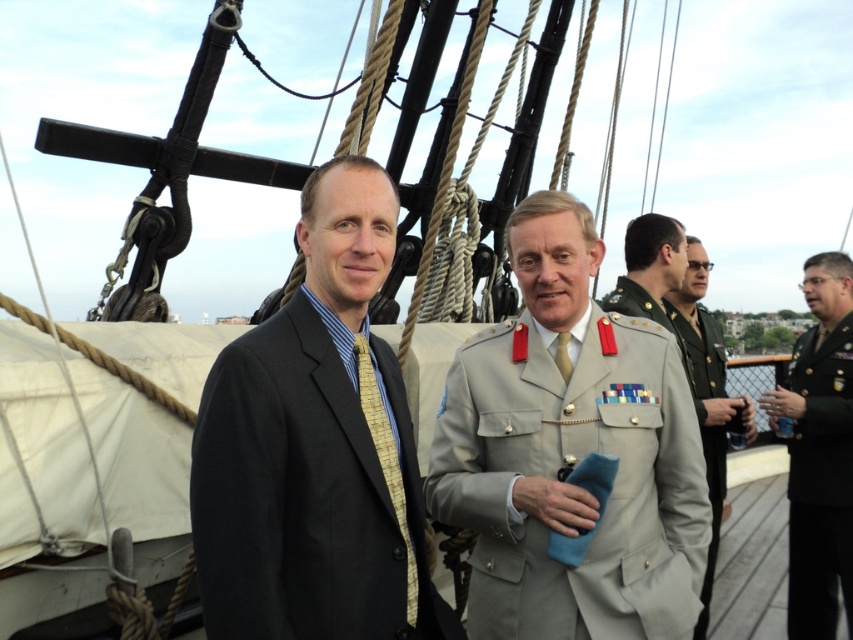
Between dark green military uniform at right and khaki military uniform at center, which one appears on the right side from the viewer's perspective?

dark green military uniform at right is more to the right.

Is dark green military uniform at right to the right of khaki military uniform at center from the viewer's perspective?

Indeed, dark green military uniform at right is positioned on the right side of khaki military uniform at center.

Locate an element on the screen. This screenshot has height=640, width=853. dark green military uniform at right is located at coordinates (819, 451).

Does matte black suit at center appear on the left side of light beige uniform at center?

Yes, matte black suit at center is to the left of light beige uniform at center.

Between matte black suit at center and light beige uniform at center, which one is positioned higher?

light beige uniform at center is above.

Is point (399, 636) less distant than point (646, 273)?

Yes, it is.

I want to click on matte black suit at center, so click(316, 448).

Who is lower down, khaki military uniform at center or light beige uniform at center?

light beige uniform at center is below.

Measure the distance from khaki military uniform at center to light beige uniform at center.

14.64 inches

The image size is (853, 640). What are the coordinates of `khaki military uniform at center` in the screenshot? It's located at (706, 394).